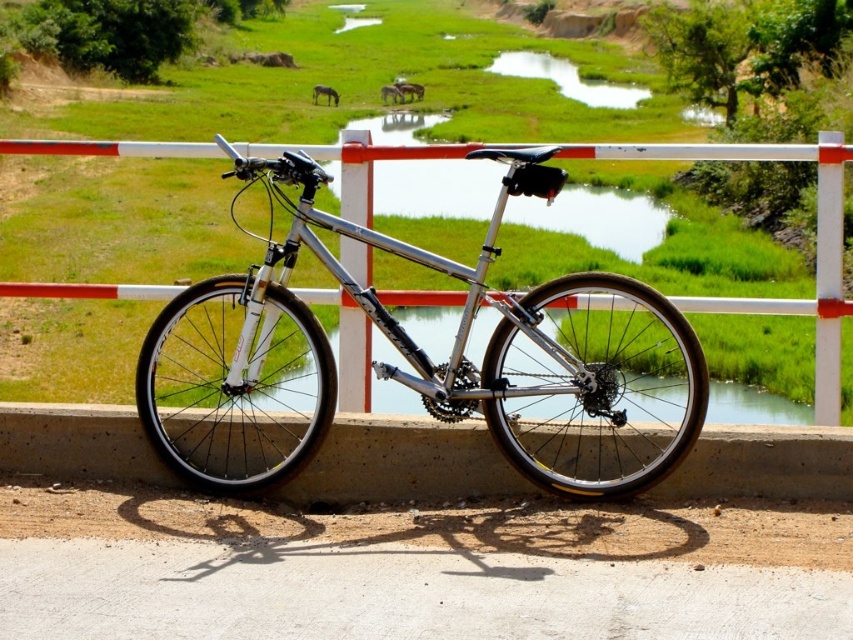
Question: Does silver metallic mountain bike at center appear over silver metallic bicycle at center?

Choices:
 (A) no
 (B) yes

Answer: (A)

Question: Among these points, which one is farthest from the camera?

Choices:
 (A) (828, 275)
 (B) (549, 166)

Answer: (A)

Question: Is silver metallic mountain bike at center positioned behind silver metallic bicycle at center?

Choices:
 (A) no
 (B) yes

Answer: (A)

Question: Which point is farther from the camera taking this photo?

Choices:
 (A) (706, 381)
 (B) (53, 291)

Answer: (B)

Question: Observing the image, what is the correct spatial positioning of silver metallic mountain bike at center in reference to silver metallic bicycle at center?

Choices:
 (A) above
 (B) below

Answer: (B)